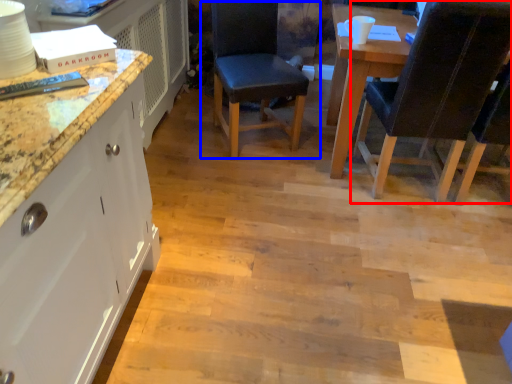
Question: Which object is closer to the camera taking this photo, chair (highlighted by a red box) or chair (highlighted by a blue box)?

Choices:
 (A) chair
 (B) chair

Answer: (A)